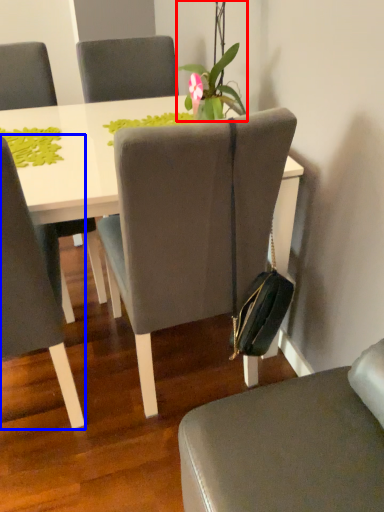
Question: Among these objects, which one is farthest to the camera, houseplant (highlighted by a red box) or chair (highlighted by a blue box)?

Choices:
 (A) houseplant
 (B) chair

Answer: (A)